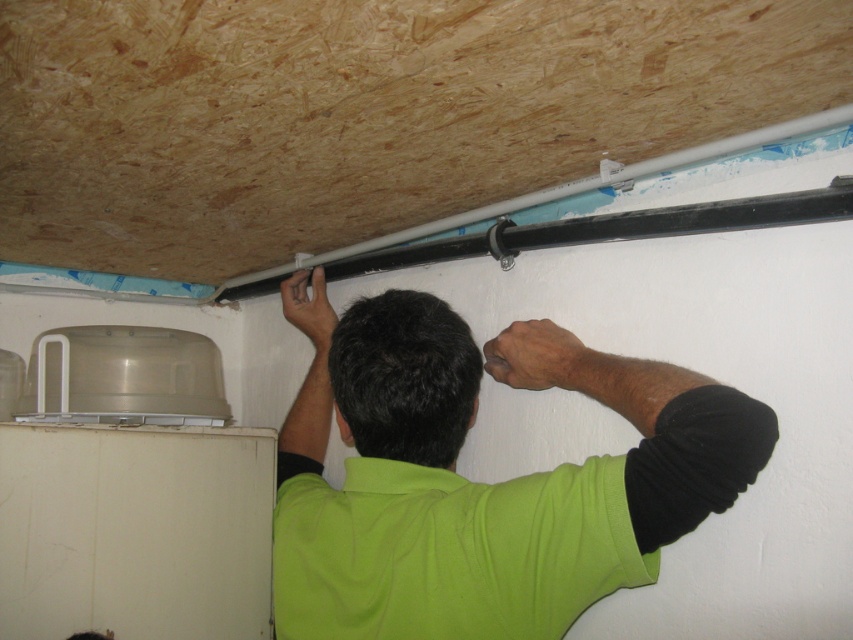
Question: Which point is closer to the camera taking this photo?

Choices:
 (A) (186, 16)
 (B) (683, 163)
 (C) (405, 429)

Answer: (A)

Question: Does white plastic exhaust hood at upper center appear on the right side of green matte shirt at center?

Choices:
 (A) yes
 (B) no

Answer: (B)

Question: Considering the relative positions of white plastic exhaust hood at upper center and white plastic pipe at upper center in the image provided, where is white plastic exhaust hood at upper center located with respect to white plastic pipe at upper center?

Choices:
 (A) left
 (B) right

Answer: (A)

Question: Which of the following is the closest to the observer?

Choices:
 (A) (514, 577)
 (B) (761, 128)

Answer: (A)

Question: Among these objects, which one is farthest from the camera?

Choices:
 (A) white plastic pipe at upper center
 (B) white plastic exhaust hood at upper center

Answer: (A)

Question: Is green matte shirt at center to the left of white plastic pipe at upper center from the viewer's perspective?

Choices:
 (A) yes
 (B) no

Answer: (A)